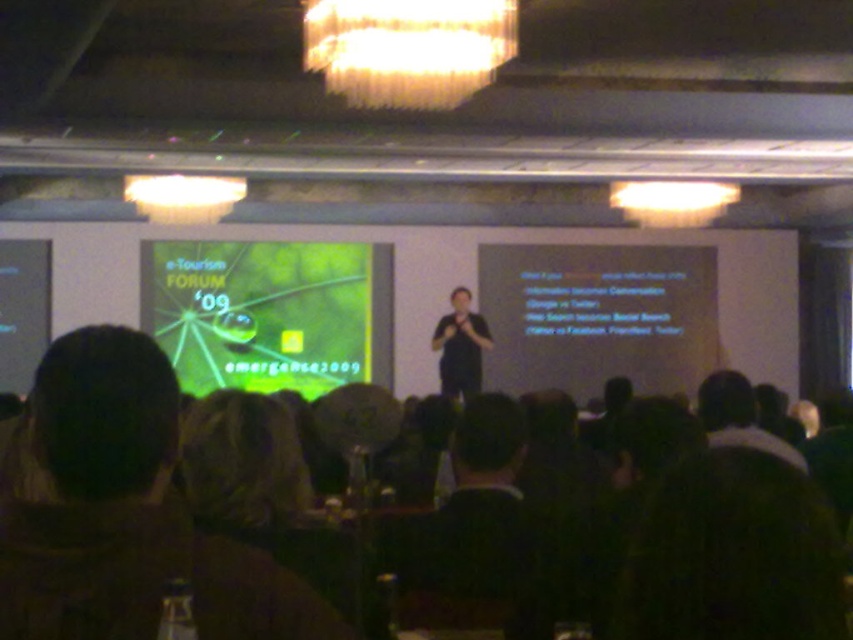
Looking at this image, how distant is dark brown hair at lower left from black matte shirt at center?

A distance of 25.32 feet exists between dark brown hair at lower left and black matte shirt at center.

Can you confirm if dark brown hair at lower left is smaller than black matte shirt at center?

Indeed, dark brown hair at lower left has a smaller size compared to black matte shirt at center.

This screenshot has width=853, height=640. Identify the location of dark brown hair at lower left. (126, 513).

At what (x,y) coordinates should I click in order to perform the action: click on dark brown hair at lower left. Please return your answer as a coordinate pair (x, y). Looking at the image, I should click on (126, 513).

Which is above, green matte projection screen at center or black matte shirt at center?

green matte projection screen at center is higher up.

Between point (229, 310) and point (445, 355), which one is positioned behind?

The point (229, 310) is more distant.

Where is `green matte projection screen at center`? The width and height of the screenshot is (853, 640). green matte projection screen at center is located at coordinates (270, 312).

Between dark brown hair at center and black matte shirt at center, which one appears on the left side from the viewer's perspective?

From the viewer's perspective, dark brown hair at center appears more on the left side.

Which is above, dark brown hair at center or black matte shirt at center?

black matte shirt at center is higher up.

Locate an element on the screen. The height and width of the screenshot is (640, 853). dark brown hair at center is located at coordinates (473, 528).

Identify the location of dark brown hair at center. pyautogui.click(x=473, y=528).